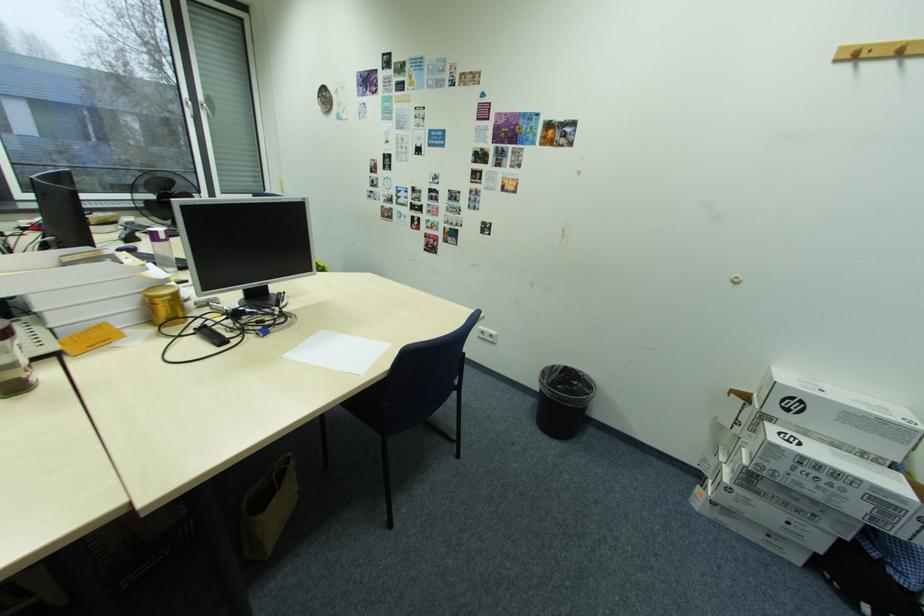
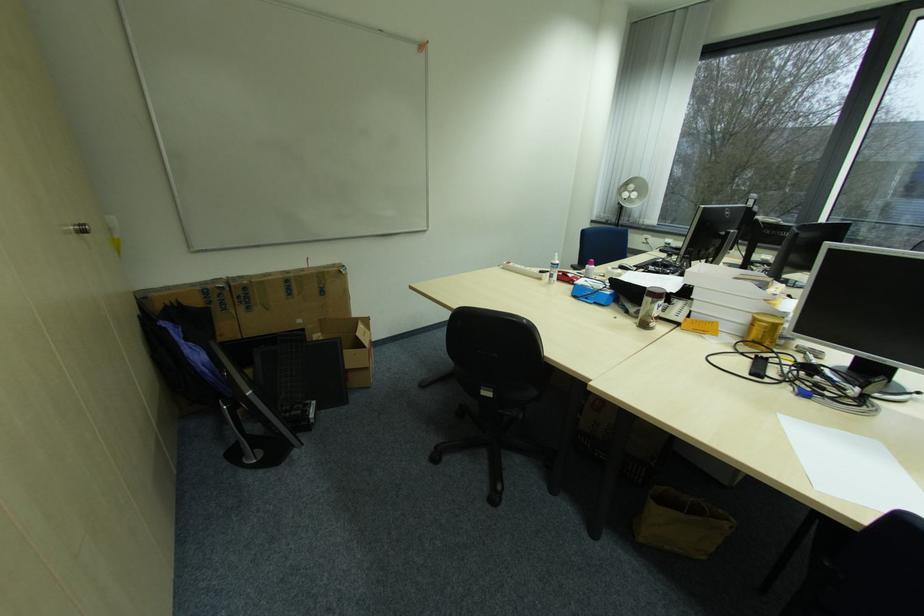
The point at (370, 375) is marked in the first image. Where is the corresponding point in the second image?

(824, 488)